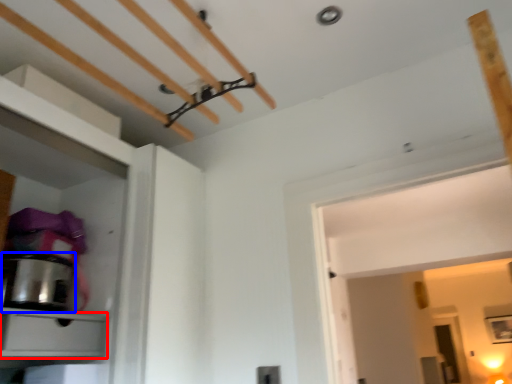
Question: Which of the following is the farthest to the observer, drawer (highlighted by a red box) or appliance (highlighted by a blue box)?

Choices:
 (A) drawer
 (B) appliance

Answer: (B)